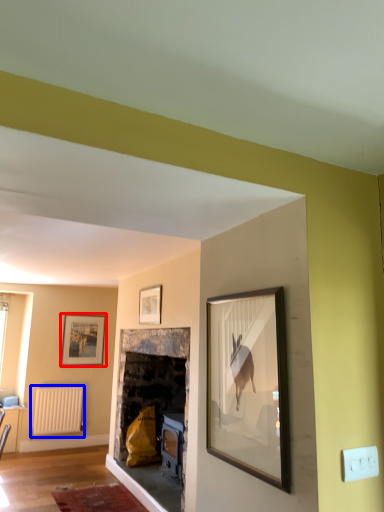
Question: Among these objects, which one is nearest to the camera, picture frame (highlighted by a red box) or radiator (highlighted by a blue box)?

Choices:
 (A) picture frame
 (B) radiator

Answer: (B)